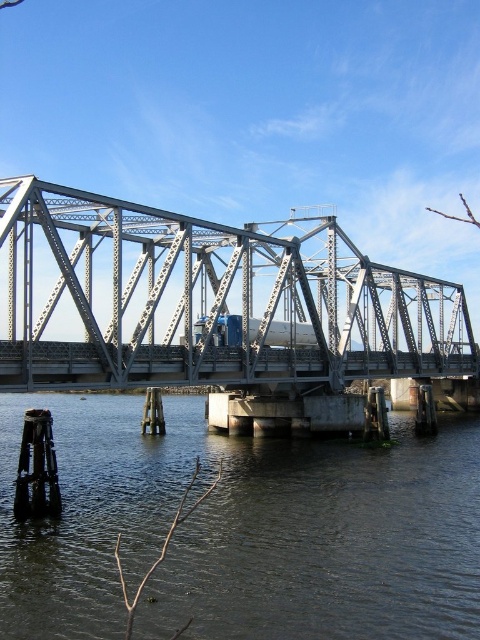
You are a photographer planning to capture the metallic gray bridge at center and the dark gray water at lower center in a single shot. Which of the two elements will occupy a larger portion of the photo?

The metallic gray bridge at center occupies a larger portion of the photo because it is larger in size compared to the dark gray water at lower center.

You are standing on the steel truss bridge and looking down. There is a point marked at coordinates (242, 531). What is located at this point?

The point at coordinates (242, 531) is the location of the dark gray water at lower center.

You are standing on the shore looking at the dark gray water at lower center and the metallic gray bridge at center. Which object is nearer to you?

Result: The dark gray water at lower center is closer to the viewer than the metallic gray bridge at center.